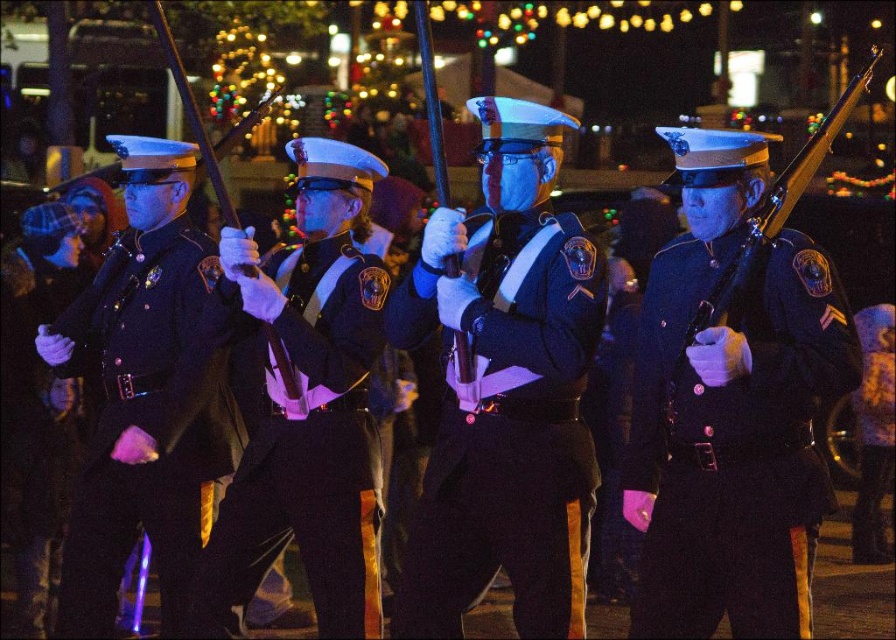
You are a photographer at the event and want to capture the shiny black uniform at center. You see the point marked at coordinates [506,429]. Is this point the correct location to focus on for the shiny black uniform at center?

Yes, the point marked at coordinates [506,429] represents the shiny black uniform at center, so focusing there will capture it correctly.

You are a photographer at a military parade. You see two uniforms on the left side of the image, a dark blue fabric uniform at left and a matte black uniform at left. Which one is positioned more to the right?

The dark blue fabric uniform at left is positioned to the right of the matte black uniform at left.

You are a photographer positioned behind the marching formation. You need to capture a photo where both the dark blue fabric uniform at left and the matte black uniform at left are clearly visible. Given that your camera has a depth of field that can sharply focus on objects within 5 feet, will both uniforms be in focus?

The distance between the dark blue fabric uniform at left and the matte black uniform at left is 5.11 feet. Since the depth of field can only focus within 5 feet, the two uniforms are slightly beyond the optimal range. However, they might still appear acceptably sharp depending on the aperture and focal length used. For best results, adjust settings to ensure both are within the 5 feet threshold.